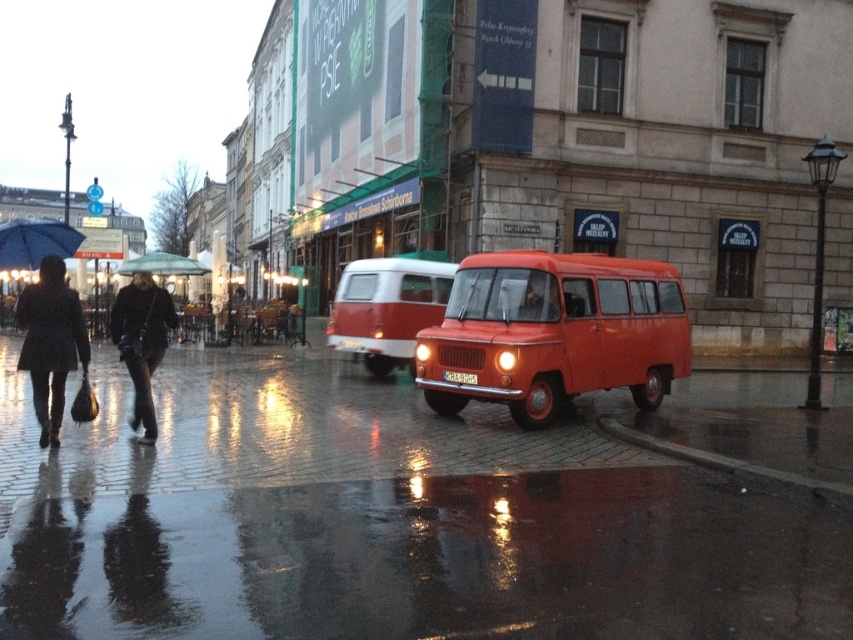
You are a delivery person with a package that needs to be placed on the glossy brick pavement at center. However, there is a transparent fabric umbrella at center in the way. Can you place the package directly on the pavement without moving the umbrella?

The glossy brick pavement at center is closer to the viewer than the transparent fabric umbrella at center, so yes, the package can be placed directly on the pavement without moving the umbrella because the umbrella is further away and not obstructing the area.

You are standing at the point of observation and want to locate the matte orange van at center. What are its coordinates in the image?

The matte orange van at center is located at coordinates point [554,332].

You are a delivery person holding a transparent fabric umbrella at center and need to load a package into the matte orange van at center. Will the umbrella fit inside the van without bending it?

The matte orange van at center is shorter than the transparent fabric umbrella at center, so the umbrella will not fit inside the van without bending it.